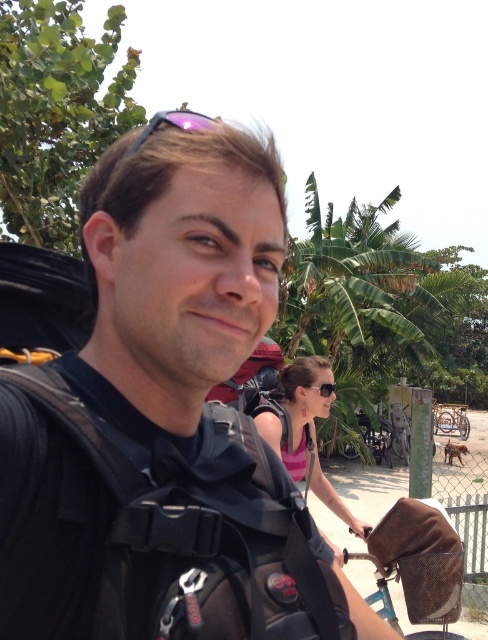
You are a photographer trying to capture both the pink fabric top at center and the purple reflective sunglasses at upper center in a single shot. Which object should you focus on first to ensure they both fit in the frame?

The pink fabric top at center is smaller than the purple reflective sunglasses at upper center, so you should focus on the purple reflective sunglasses at upper center first to ensure both objects fit in the frame.

From the picture: You are a photographer trying to capture a clear photo of the pink fabric top at center without the black backpack at center blocking it. Based on the scene, how should you adjust your camera angle?

The black backpack at center is positioned over the pink fabric top at center, so to avoid blocking, you should lower your camera angle to capture the pink fabric top at center below the backpack.

You are a photographer trying to capture a clear shot of the pink fabric top at center and the purple reflective sunglasses at upper center. Since you want to focus on the smaller object, which one should you zoom in on?

The pink fabric top at center has a lesser width compared to the purple reflective sunglasses at upper center, so you should zoom in on the pink fabric top at center.